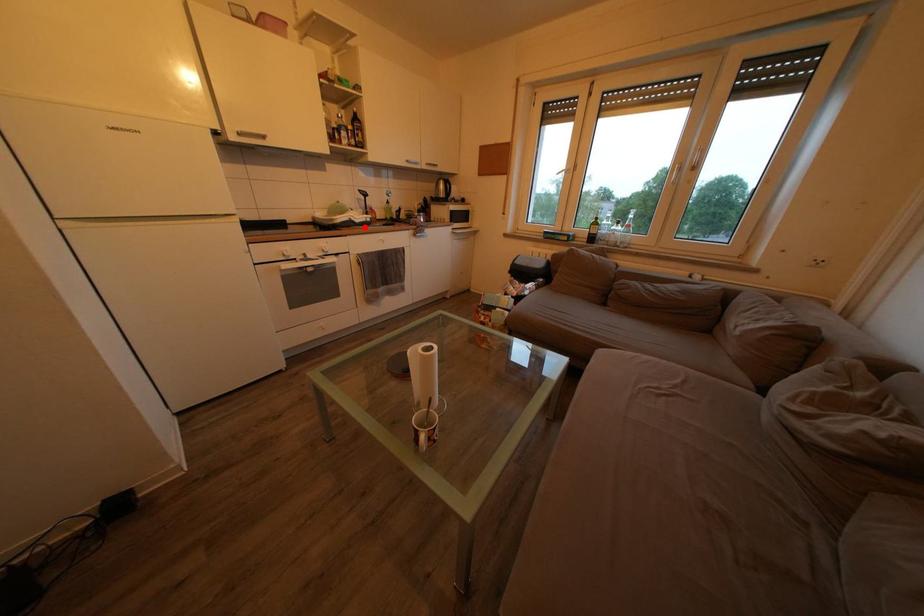
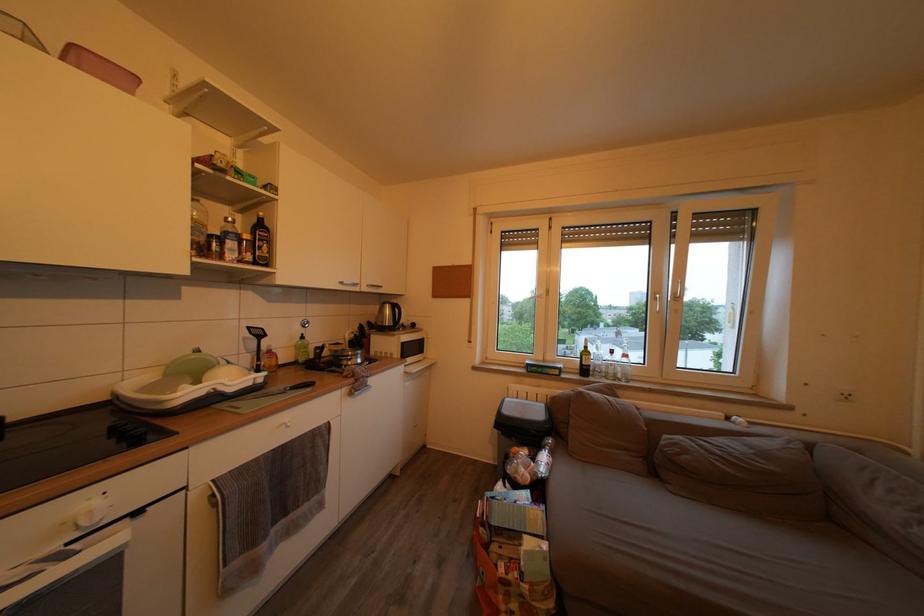
Question: I am providing you with two images of the same scene from different viewpoints. A red point is shown in image1. For the corresponding object point in image2, is it positioned nearer or farther from the camera?

Choices:
 (A) Nearer
 (B) Farther

Answer: (B)